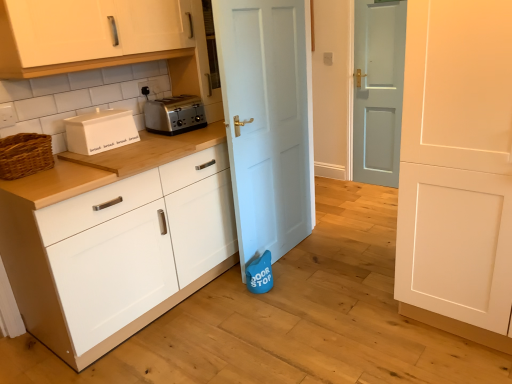
Identify the location of vacant space to the left of light blue wooden door at center, acting as the first door starting from the back. Image resolution: width=512 pixels, height=384 pixels. (349, 184).